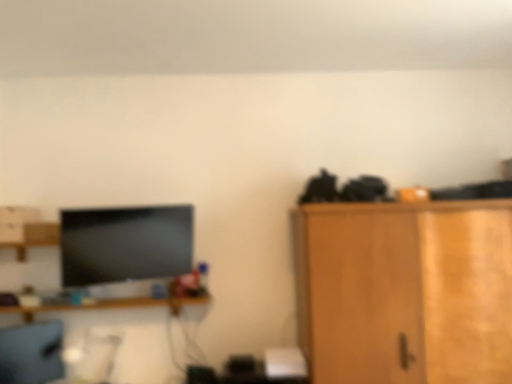
Question: Is wooden shelf at center taller than wooden cabinet at right?

Choices:
 (A) no
 (B) yes

Answer: (A)

Question: Considering the relative sizes of wooden shelf at center and wooden cabinet at right in the image provided, is wooden shelf at center bigger than wooden cabinet at right?

Choices:
 (A) yes
 (B) no

Answer: (B)

Question: Considering the relative sizes of wooden shelf at center and wooden cabinet at right in the image provided, is wooden shelf at center shorter than wooden cabinet at right?

Choices:
 (A) yes
 (B) no

Answer: (A)

Question: From the image's perspective, is wooden shelf at center beneath wooden cabinet at right?

Choices:
 (A) yes
 (B) no

Answer: (A)

Question: Is the position of wooden shelf at center less distant than that of wooden cabinet at right?

Choices:
 (A) yes
 (B) no

Answer: (B)

Question: From a real-world perspective, is wooden shelf at center beneath wooden cabinet at right?

Choices:
 (A) no
 (B) yes

Answer: (A)

Question: Does matte gray computer chair at lower left have a greater width compared to wooden cabinet at right?

Choices:
 (A) no
 (B) yes

Answer: (A)

Question: Is matte gray computer chair at lower left positioned in front of wooden cabinet at right?

Choices:
 (A) yes
 (B) no

Answer: (B)

Question: Would you say matte gray computer chair at lower left contains wooden cabinet at right?

Choices:
 (A) yes
 (B) no

Answer: (B)

Question: Is matte gray computer chair at lower left next to wooden cabinet at right?

Choices:
 (A) yes
 (B) no

Answer: (B)

Question: Is matte gray computer chair at lower left to the right of wooden cabinet at right from the viewer's perspective?

Choices:
 (A) no
 (B) yes

Answer: (A)

Question: From the image's perspective, is matte gray computer chair at lower left on top of wooden cabinet at right?

Choices:
 (A) yes
 (B) no

Answer: (B)

Question: From a real-world perspective, is wooden cabinet at right positioned over wooden shelf at center based on gravity?

Choices:
 (A) no
 (B) yes

Answer: (A)